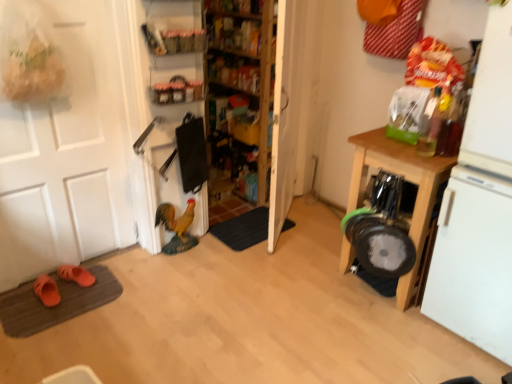
Where is `free space to the right of orange rubber slippers at lower left, positioned as the first footwear in front-to-back order`? free space to the right of orange rubber slippers at lower left, positioned as the first footwear in front-to-back order is located at coordinates (79, 300).